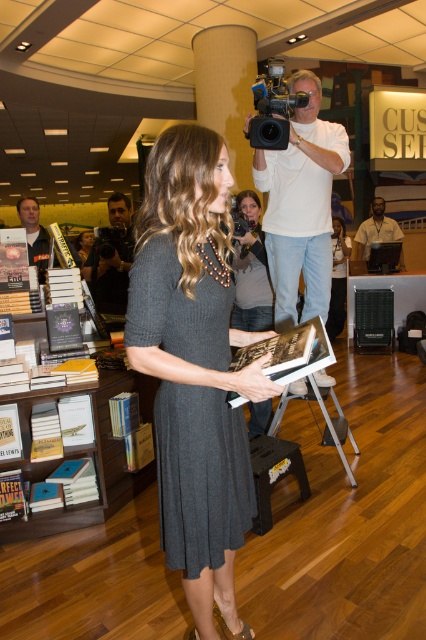
Can you confirm if black matte dress at center is wider than dark gray dress at center?

No.

Is point (342, 305) farther from camera compared to point (86, 253)?

No, (342, 305) is closer to viewer.

Is point (330, 326) farther from viewer compared to point (78, 241)?

No, it is not.

Locate an element on the screen. black matte dress at center is located at coordinates (337, 276).

Is dark gray wood bookshelf at center positioned behind dark brown leather laptop at center?

That is False.

Which of these two, dark gray wood bookshelf at center or dark brown leather laptop at center, stands taller?

With more height is dark brown leather laptop at center.

Does point (51, 467) come farther from viewer compared to point (399, 232)?

No, it is not.

Where is `dark gray wood bookshelf at center`? The width and height of the screenshot is (426, 640). dark gray wood bookshelf at center is located at coordinates (83, 456).

Between dark gray shirt at center and black plastic video camera at upper center, which one is positioned lower?

dark gray shirt at center

The height and width of the screenshot is (640, 426). I want to click on dark gray shirt at center, so click(112, 260).